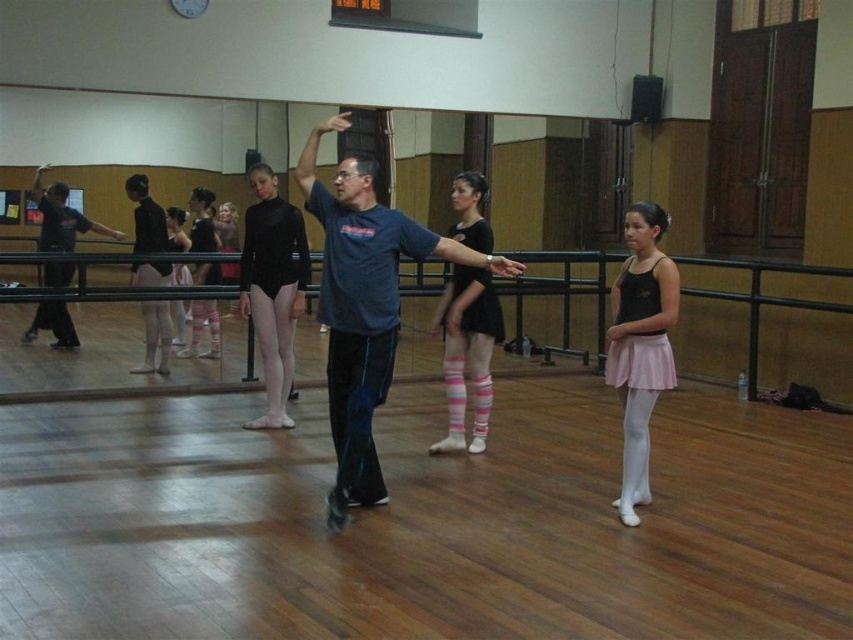
Question: Does pink striped tights at center appear under matte black shirt at left?

Choices:
 (A) yes
 (B) no

Answer: (A)

Question: Is pink satin skirt at lower right bigger than pink striped tights at center?

Choices:
 (A) no
 (B) yes

Answer: (A)

Question: Is pink striped tights at center below matte black tights at center?

Choices:
 (A) no
 (B) yes

Answer: (B)

Question: Considering the real-world distances, which object is farthest from the pink satin ballet skirt at lower right?

Choices:
 (A) pink striped tights at center
 (B) black leotard at center
 (C) matte black tights at center

Answer: (C)

Question: Which point appears farthest from the camera in this image?

Choices:
 (A) (329, 518)
 (B) (671, 371)
 (C) (30, 337)

Answer: (C)

Question: Which point appears farthest from the camera in this image?

Choices:
 (A) (131, 173)
 (B) (648, 248)
 (C) (67, 340)
 (D) (285, 326)

Answer: (A)